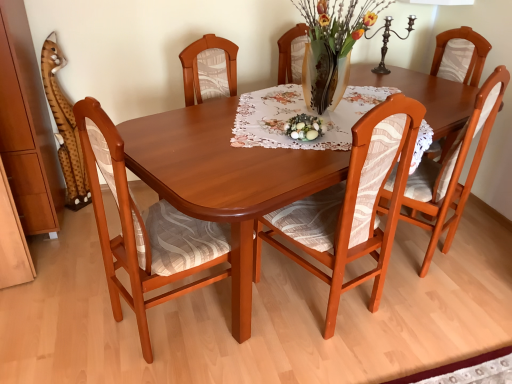
Find the location of `vacant space situated on the left part of wooden chair at left, which is the 3th chair from right to left`. vacant space situated on the left part of wooden chair at left, which is the 3th chair from right to left is located at coordinates (75, 334).